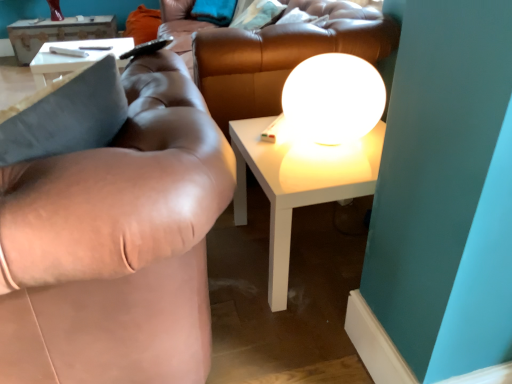
Question: Should I look upward or downward to see soft teal pillow at upper center, arranged as the 1th pillow when viewed from the front?

Choices:
 (A) up
 (B) down

Answer: (A)

Question: Is white glossy table at upper left, which is counted as the 2th table, starting from the bottom, bigger than orange fabric pillow at upper left, which appears as the 1th pillow when viewed from the left?

Choices:
 (A) yes
 (B) no

Answer: (A)

Question: Is white glossy table at upper left, which ranks as the first table in left-to-right order, looking in the opposite direction of orange fabric pillow at upper left, the 2th pillow from the front?

Choices:
 (A) no
 (B) yes

Answer: (A)

Question: Could you tell me if white glossy table at upper left, the 1th table in the top-to-bottom sequence, is facing orange fabric pillow at upper left, the first pillow when ordered from back to front?

Choices:
 (A) yes
 (B) no

Answer: (B)

Question: Is white glossy table at upper left, the 1th table when ordered from back to front, completely or partially outside of orange fabric pillow at upper left, the first pillow when ordered from back to front?

Choices:
 (A) yes
 (B) no

Answer: (A)

Question: Is the depth of white glossy table at upper left, which appears as the second table when viewed from the right, less than that of orange fabric pillow at upper left, the 2th pillow from the front?

Choices:
 (A) no
 (B) yes

Answer: (A)

Question: Can you confirm if white glossy table at upper left, which appears as the second table when viewed from the right, is taller than orange fabric pillow at upper left, the 2th pillow from the front?

Choices:
 (A) yes
 (B) no

Answer: (B)

Question: Considering the relative positions of white glossy sphere at upper center and orange fabric pillow at upper left, which appears as the 1th pillow when viewed from the left, in the image provided, is white glossy sphere at upper center to the left of orange fabric pillow at upper left, which appears as the 1th pillow when viewed from the left, from the viewer's perspective?

Choices:
 (A) yes
 (B) no

Answer: (B)

Question: From a real-world perspective, is white glossy sphere at upper center under orange fabric pillow at upper left, the first pillow when ordered from back to front?

Choices:
 (A) no
 (B) yes

Answer: (A)

Question: Can you confirm if white glossy sphere at upper center is thinner than orange fabric pillow at upper left, the second pillow viewed from the right?

Choices:
 (A) yes
 (B) no

Answer: (A)

Question: Is white glossy sphere at upper center wider than orange fabric pillow at upper left, which appears as the 1th pillow when viewed from the left?

Choices:
 (A) no
 (B) yes

Answer: (A)

Question: Is white glossy sphere at upper center taller than orange fabric pillow at upper left, which appears as the 1th pillow when viewed from the left?

Choices:
 (A) yes
 (B) no

Answer: (B)

Question: Does white glossy sphere at upper center have a larger size compared to orange fabric pillow at upper left, the 2th pillow from the front?

Choices:
 (A) yes
 (B) no

Answer: (B)

Question: Considering the relative sizes of white glossy sphere at upper center and white glossy table at center, the second table when ordered from left to right, in the image provided, is white glossy sphere at upper center smaller than white glossy table at center, the second table when ordered from left to right,?

Choices:
 (A) yes
 (B) no

Answer: (A)